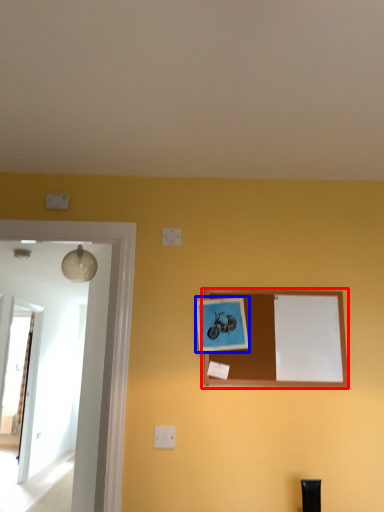
Question: Among these objects, which one is nearest to the camera, picture frame (highlighted by a red box) or picture frame (highlighted by a blue box)?

Choices:
 (A) picture frame
 (B) picture frame

Answer: (B)